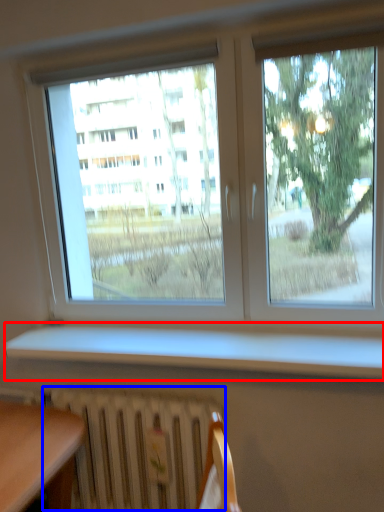
Question: Which object appears closest to the camera in this image, window sill (highlighted by a red box) or radiator (highlighted by a blue box)?

Choices:
 (A) window sill
 (B) radiator

Answer: (A)